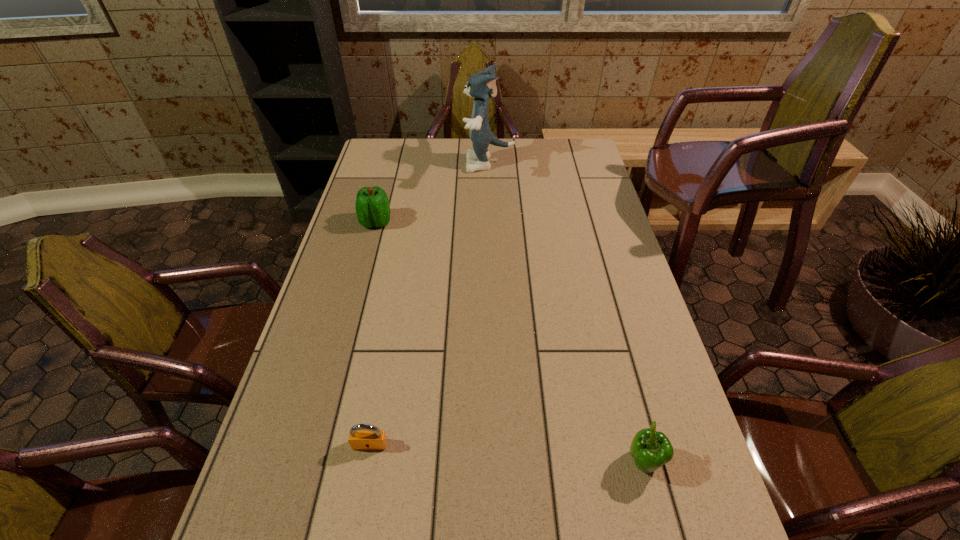
At what (x,y) coordinates should I click in order to perform the action: click on vacant area between the rightmost object and the padlock. Please return your answer as a coordinate pair (x, y). This screenshot has width=960, height=540. Looking at the image, I should click on (507, 454).

In order to click on empty space between the second object from left to right and the tallest object in this screenshot , I will do `click(431, 304)`.

Locate which object is the second closest to the padlock. Please provide its 2D coordinates. Your answer should be formatted as a tuple, i.e. [(x, y)], where the tuple contains the x and y coordinates of a point satisfying the conditions above.

[(372, 205)]

Choose which object is the nearest neighbor to the shortest object. Please provide its 2D coordinates. Your answer should be formatted as a tuple, i.e. [(x, y)], where the tuple contains the x and y coordinates of a point satisfying the conditions above.

[(650, 449)]

At what (x,y) coordinates should I click in order to perform the action: click on vacant space that satisfies the following two spatial constraints: 1. on the front-facing side of the tallest object; 2. to unlock the padlock from the front. Please return your answer as a coordinate pair (x, y). This screenshot has height=540, width=960. Looking at the image, I should click on (501, 444).

Where is `vacant position in the image that satisfies the following two spatial constraints: 1. to unlock the third object from right to left from the front; 2. on the left side of the rightmost object`? This screenshot has height=540, width=960. vacant position in the image that satisfies the following two spatial constraints: 1. to unlock the third object from right to left from the front; 2. on the left side of the rightmost object is located at coordinates (367, 463).

The height and width of the screenshot is (540, 960). In order to click on vacant space that satisfies the following two spatial constraints: 1. on the front side of the right bell pepper; 2. on the right side of the farther bell pepper in this screenshot , I will do `click(311, 463)`.

Where is `vacant region that satisfies the following two spatial constraints: 1. to unlock the right bell pepper from the front; 2. on the right side of the shortest object`? This screenshot has height=540, width=960. vacant region that satisfies the following two spatial constraints: 1. to unlock the right bell pepper from the front; 2. on the right side of the shortest object is located at coordinates (367, 463).

This screenshot has width=960, height=540. Identify the location of free space that satisfies the following two spatial constraints: 1. on the front-facing side of the right bell pepper; 2. on the left side of the cat. 502,463.